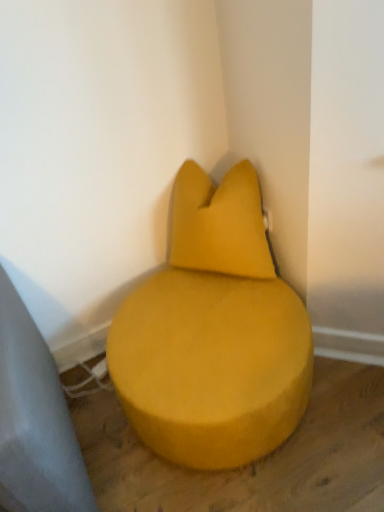
Measure the distance between point (179, 283) and camera.

Point (179, 283) and camera are 1.49 meters apart from each other.

The width and height of the screenshot is (384, 512). I want to click on yellow fabric pouf at center, so click(213, 333).

In order to face yellow fabric pouf at center, should I rotate leftwards or rightwards?

Rotate your view right by about 2.419°.

What do you see at coordinates (213, 333) in the screenshot? I see `yellow fabric pouf at center` at bounding box center [213, 333].

In order to click on yellow fabric pouf at center in this screenshot , I will do `click(213, 333)`.